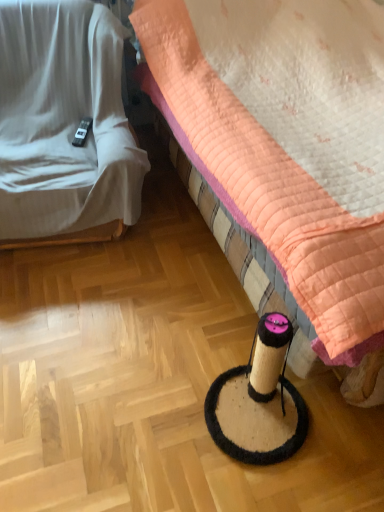
The height and width of the screenshot is (512, 384). Find the location of `vacant space in front of white fabric couch at left`. vacant space in front of white fabric couch at left is located at coordinates (96, 324).